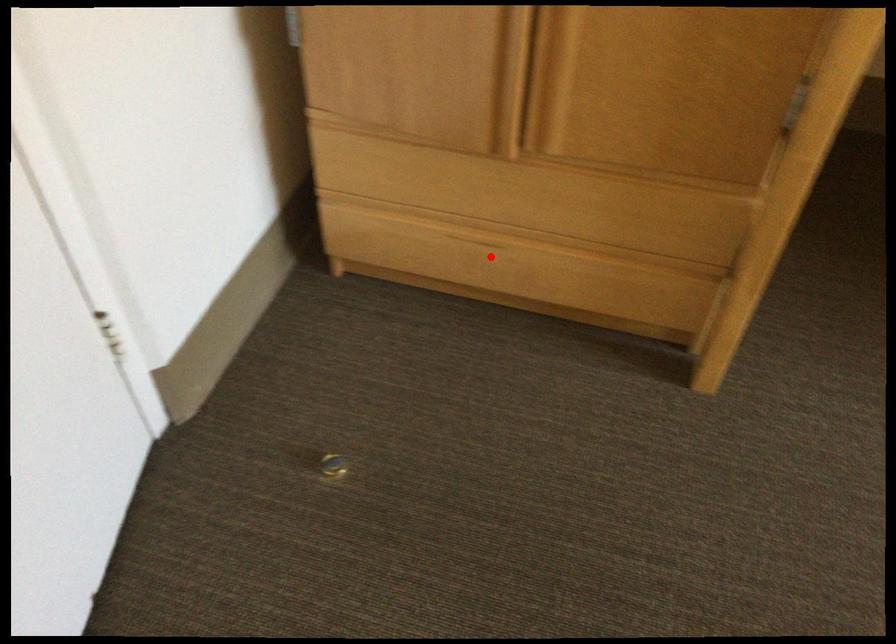
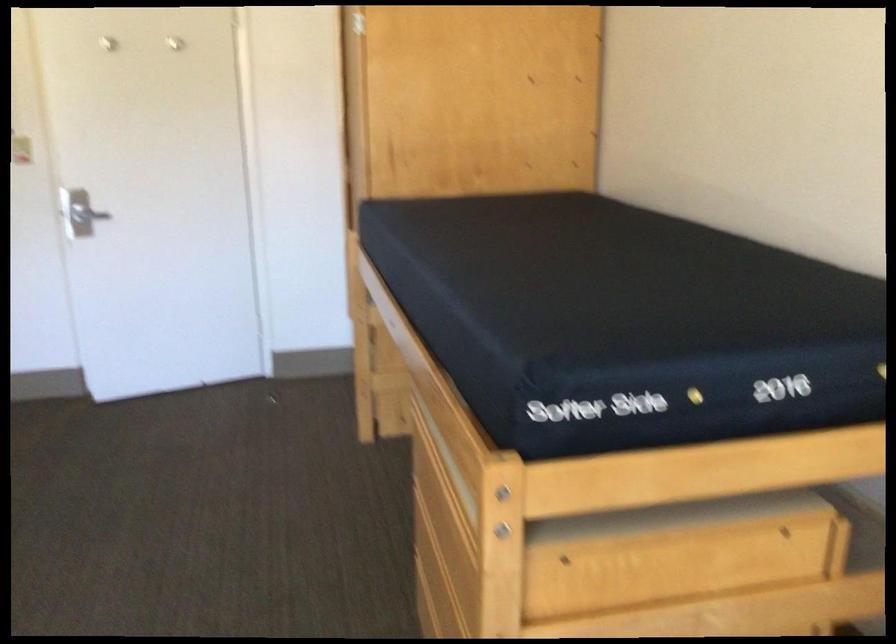
Question: I am providing you with two images of the same scene from different viewpoints. A red point is marked on the first image. Is the red point's position out of view in image 2?

Choices:
 (A) Yes
 (B) No

Answer: (A)